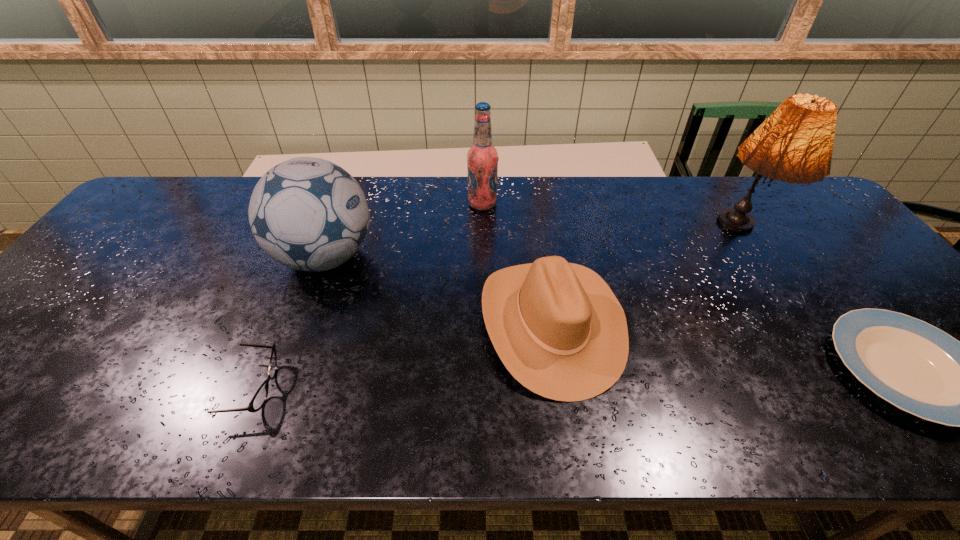
The width and height of the screenshot is (960, 540). I want to click on free space that satisfies the following two spatial constraints: 1. on the front-facing side of the tallest object; 2. on the front-facing side of the second shortest object, so click(x=834, y=388).